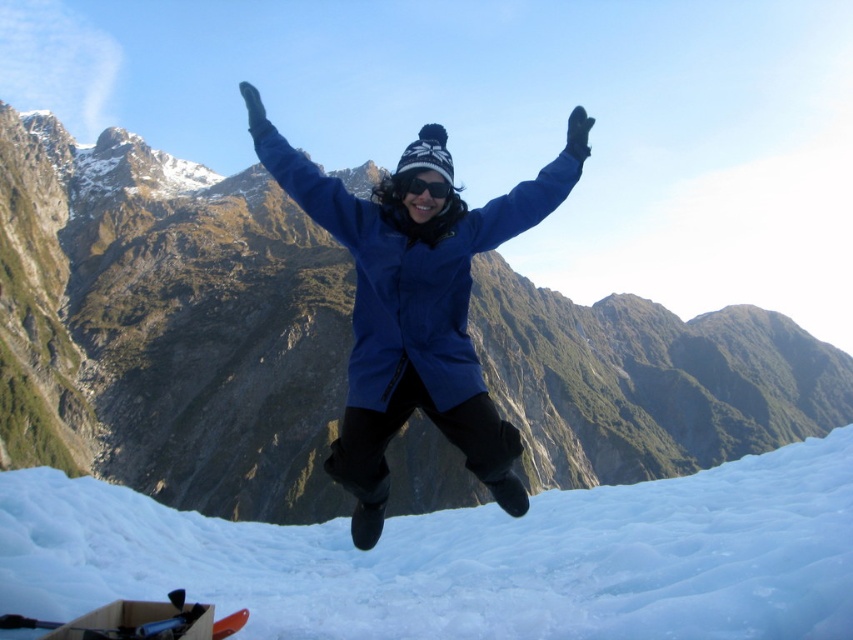
Question: Which point is farther from the camera taking this photo?

Choices:
 (A) (442, 419)
 (B) (445, 182)

Answer: (B)

Question: Does blue matte jacket at center appear over black matte goggles at center?

Choices:
 (A) yes
 (B) no

Answer: (B)

Question: Which point is farther to the camera?

Choices:
 (A) white frosty snow at lower center
 (B) blue matte jacket at center
 (C) black matte goggles at center

Answer: (C)

Question: Can you confirm if matte blue jacket at center is positioned below blue matte jacket at center?

Choices:
 (A) no
 (B) yes

Answer: (A)

Question: Which point appears farthest from the camera in this image?

Choices:
 (A) (410, 186)
 (B) (798, 416)
 (C) (351, 419)
 (D) (515, 554)

Answer: (B)

Question: Is matte blue jacket at center closer to camera compared to black matte goggles at center?

Choices:
 (A) yes
 (B) no

Answer: (B)